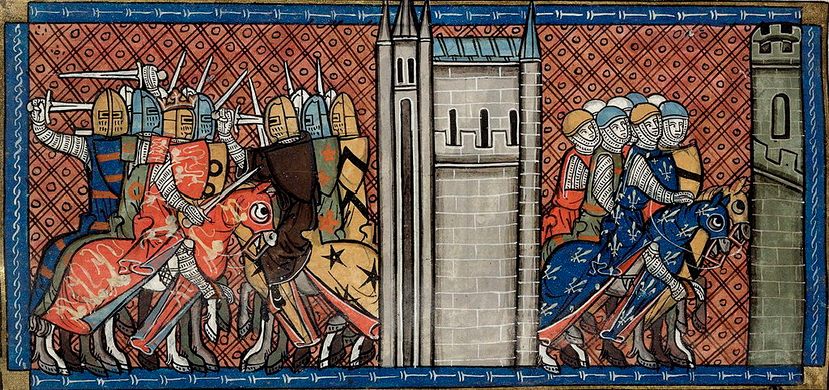
Locate an element on the screen. The height and width of the screenshot is (390, 829). archway is located at coordinates (453, 117), (485, 119), (511, 119).